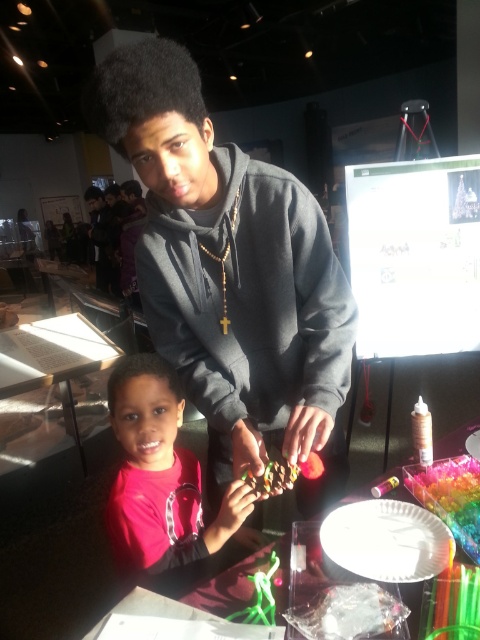
You are a tailor trying to fit a customer for a new hoodie. The customer has two hoodies in the image, the dark gray hoodie at upper center and the matte black hoodie at upper center. Which hoodie has a larger width according to the description?

The matte black hoodie at upper center has a larger width than the dark gray hoodie at upper center.